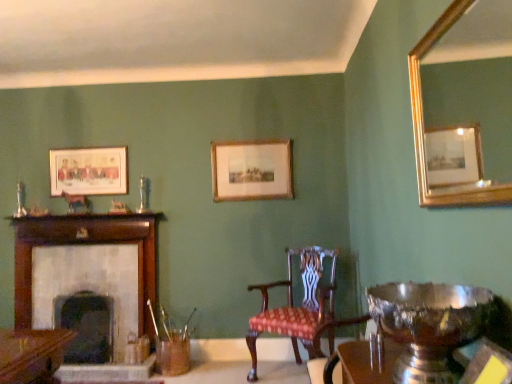
Question: Is matte wooden picture frame at upper left, the 2th picture frame from the right, surrounding gold-framed mirror at upper right?

Choices:
 (A) no
 (B) yes

Answer: (A)

Question: Is matte wooden picture frame at upper left, the 2th picture frame from the right, further to camera compared to gold-framed mirror at upper right?

Choices:
 (A) yes
 (B) no

Answer: (A)

Question: From a real-world perspective, is matte wooden picture frame at upper left, arranged as the 1th picture frame when viewed from the left, located beneath gold-framed mirror at upper right?

Choices:
 (A) no
 (B) yes

Answer: (A)

Question: Considering the relative positions of matte wooden picture frame at upper left, arranged as the 1th picture frame when viewed from the left, and gold-framed mirror at upper right in the image provided, is matte wooden picture frame at upper left, arranged as the 1th picture frame when viewed from the left, to the right of gold-framed mirror at upper right from the viewer's perspective?

Choices:
 (A) no
 (B) yes

Answer: (A)

Question: Does matte wooden picture frame at upper left, arranged as the 1th picture frame when viewed from the left, turn towards gold-framed mirror at upper right?

Choices:
 (A) no
 (B) yes

Answer: (A)

Question: Is matte wooden picture frame at upper left, arranged as the 1th picture frame when viewed from the back, thinner than gold-framed mirror at upper right?

Choices:
 (A) no
 (B) yes

Answer: (B)

Question: Does gold-framed mirror at upper right have a lesser width compared to dark gray stone fireplace at left, the 1th fireplace in the right-to-left sequence?

Choices:
 (A) yes
 (B) no

Answer: (A)

Question: From a real-world perspective, is gold-framed mirror at upper right on dark gray stone fireplace at left, acting as the 2th fireplace starting from the left?

Choices:
 (A) yes
 (B) no

Answer: (A)

Question: Is gold-framed mirror at upper right positioned beyond the bounds of dark gray stone fireplace at left, the 1th fireplace in the right-to-left sequence?

Choices:
 (A) yes
 (B) no

Answer: (A)

Question: Does gold-framed mirror at upper right have a smaller size compared to dark gray stone fireplace at left, acting as the 2th fireplace starting from the left?

Choices:
 (A) yes
 (B) no

Answer: (A)

Question: Is dark gray stone fireplace at left, the 1th fireplace in the right-to-left sequence, completely or partially inside gold-framed mirror at upper right?

Choices:
 (A) yes
 (B) no

Answer: (B)

Question: From the image's perspective, is gold-framed mirror at upper right located beneath dark gray stone fireplace at left, the 1th fireplace in the right-to-left sequence?

Choices:
 (A) no
 (B) yes

Answer: (A)

Question: Does gold-framed picture at center, which is the 2th picture frame in left-to-right order, have a smaller size compared to dark gray stone fireplace at left, acting as the 2th fireplace starting from the left?

Choices:
 (A) no
 (B) yes

Answer: (B)